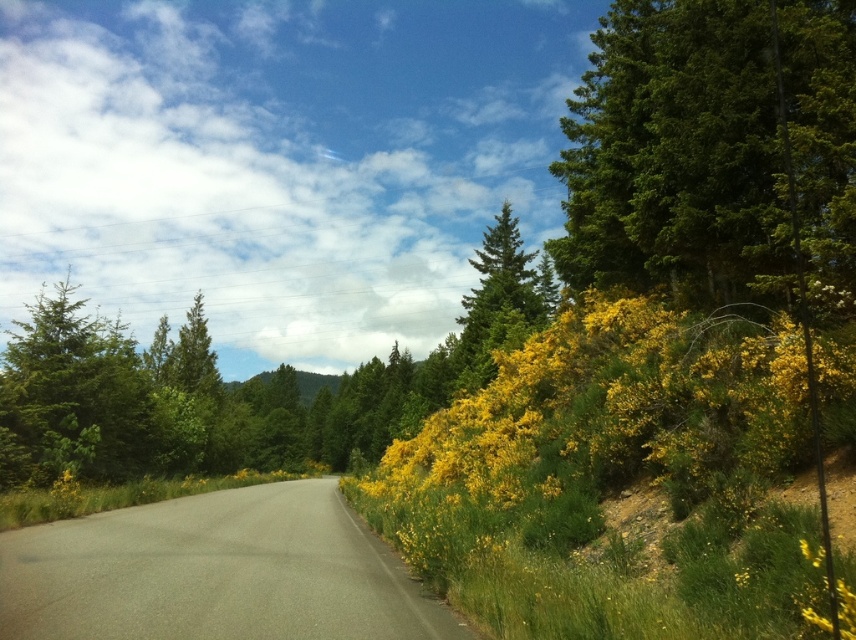
Question: In this image, where is green glossy tree at upper right located relative to green textured pine tree at center?

Choices:
 (A) above
 (B) below

Answer: (A)

Question: Is green glossy tree at upper right wider than green textured pine tree at center?

Choices:
 (A) yes
 (B) no

Answer: (B)

Question: Among these objects, which one is farthest from the camera?

Choices:
 (A) green glossy tree at upper right
 (B) green textured pine tree at center

Answer: (B)

Question: Which point appears farthest from the camera in this image?

Choices:
 (A) (486, 232)
 (B) (803, 198)

Answer: (A)

Question: Which point is farther from the camera taking this photo?

Choices:
 (A) (526, 317)
 (B) (846, 166)

Answer: (A)

Question: Can you confirm if green glossy tree at upper right is smaller than green textured pine tree at center?

Choices:
 (A) no
 (B) yes

Answer: (B)